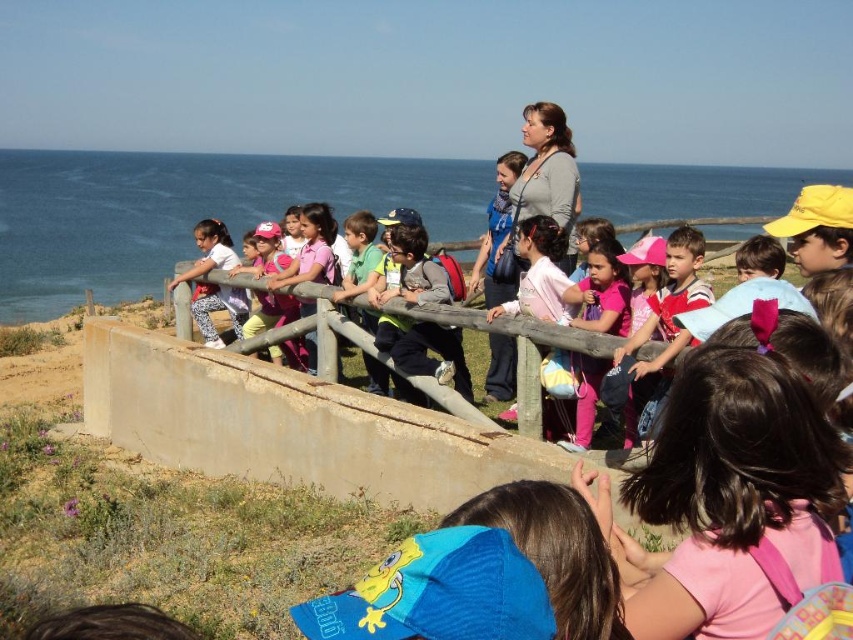
Which is more to the right, matte gray sweater at center or matte gray backpack at center?

From the viewer's perspective, matte gray sweater at center appears more on the right side.

Between matte gray sweater at center and matte gray backpack at center, which one appears on the left side from the viewer's perspective?

matte gray backpack at center is more to the left.

Find the location of a particular element. matte gray sweater at center is located at coordinates (538, 193).

This screenshot has width=853, height=640. Find the location of `matte gray sweater at center`. matte gray sweater at center is located at coordinates (538, 193).

Who is more forward, [422,280] or [688,276]?

Point [688,276] is more forward.

Does matte gray backpack at center have a greater width compared to striped shirt at center?

Correct, the width of matte gray backpack at center exceeds that of striped shirt at center.

Locate an element on the screen. This screenshot has height=640, width=853. matte gray backpack at center is located at coordinates (432, 356).

How far apart are blue water at upper left and striped shirt at center?

blue water at upper left and striped shirt at center are 50.87 meters apart.

Measure the distance between blue water at upper left and striped shirt at center.

The distance of blue water at upper left from striped shirt at center is 50.87 meters.

This screenshot has width=853, height=640. I want to click on blue water at upper left, so click(x=189, y=212).